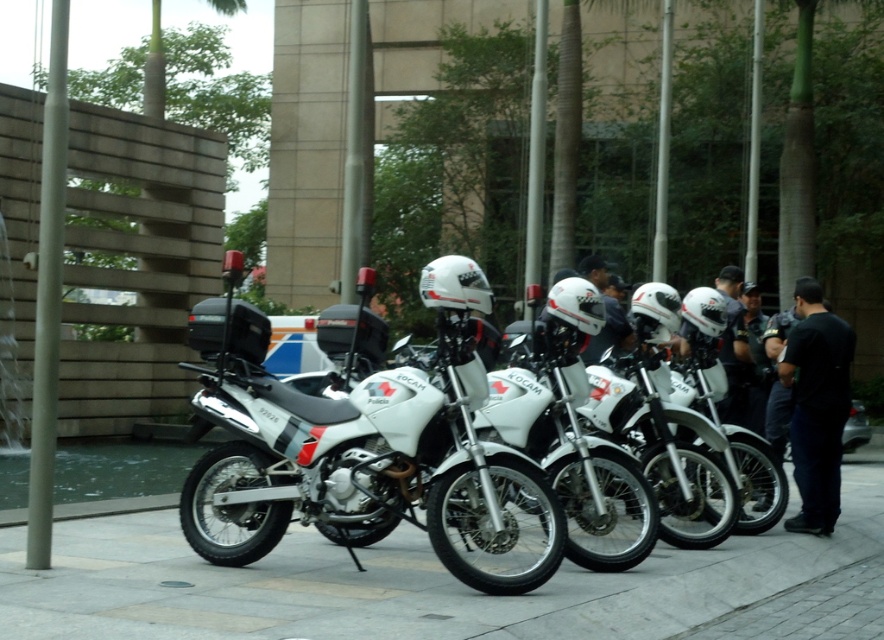
Question: Which of the following is the closest to the observer?

Choices:
 (A) black matte shirt at center
 (B) gray concrete pavement at center
 (C) white matte motorcycle at center

Answer: (B)

Question: Which point is farther to the camera?

Choices:
 (A) (806, 396)
 (B) (408, 396)

Answer: (A)

Question: Estimate the real-world distances between objects in this image. Which object is farther from the gray concrete pavement at center?

Choices:
 (A) white matte motorcycle at center
 (B) black matte shirt at center

Answer: (B)

Question: Is white matte motorcycle at center below black matte shirt at center?

Choices:
 (A) no
 (B) yes

Answer: (B)

Question: Does white matte motorcycle at center appear under black matte shirt at center?

Choices:
 (A) yes
 (B) no

Answer: (A)

Question: Does gray concrete pavement at center have a greater width compared to white matte motorcycle at center?

Choices:
 (A) no
 (B) yes

Answer: (A)